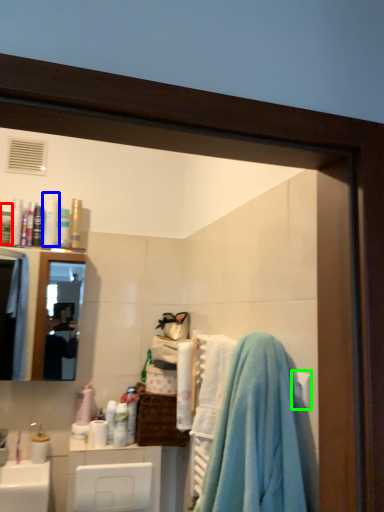
Question: Which object is the farthest from toiletry (highlighted by a red box)? Choose among these: toiletry (highlighted by a blue box) or towel bar (highlighted by a green box).

Choices:
 (A) toiletry
 (B) towel bar

Answer: (B)